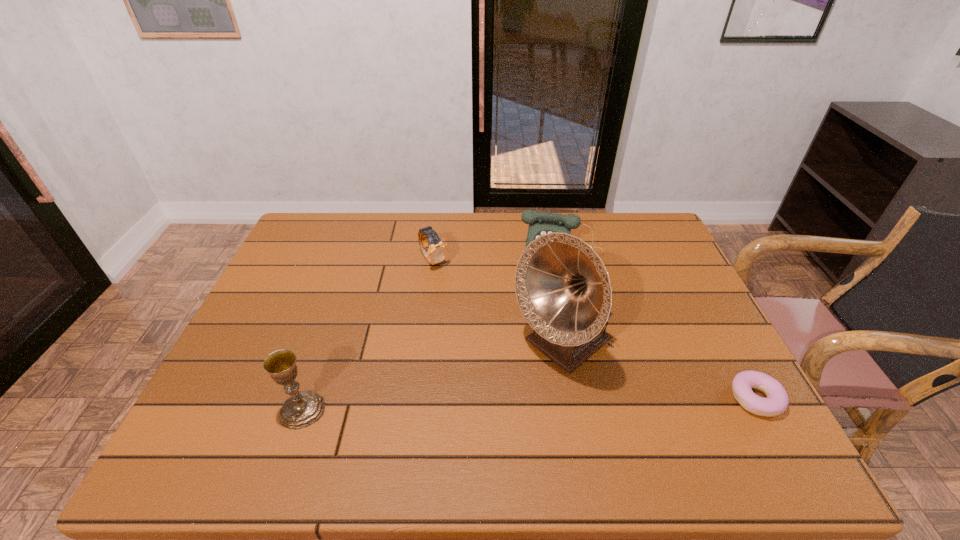
I want to click on the second closest object to the phonograph record, so click(777, 400).

This screenshot has height=540, width=960. I want to click on vacant space that satisfies the following two spatial constraints: 1. on the back side of the chalice; 2. on the left side of the tallest object, so click(324, 346).